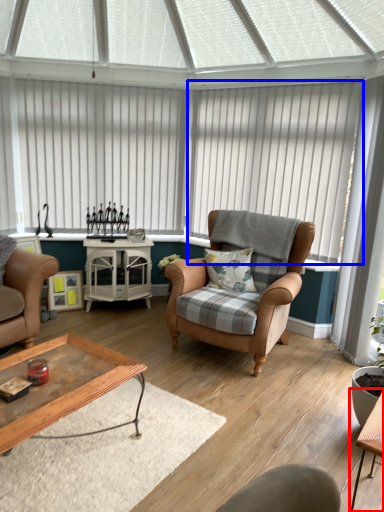
Question: Which point is further to the camera, table (highlighted by a red box) or blind (highlighted by a blue box)?

Choices:
 (A) table
 (B) blind

Answer: (B)